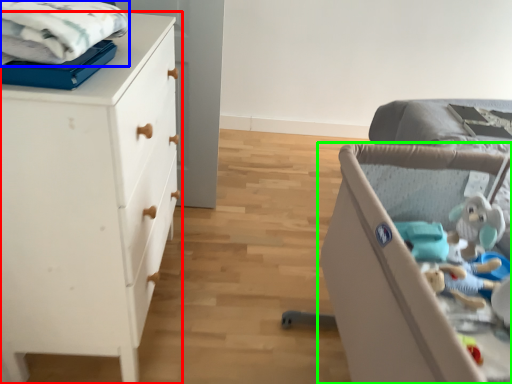
Question: Which object is the closest to the chest of drawers (highlighted by a red box)? Choose among these: cloth (highlighted by a blue box) or infant bed (highlighted by a green box).

Choices:
 (A) cloth
 (B) infant bed

Answer: (A)